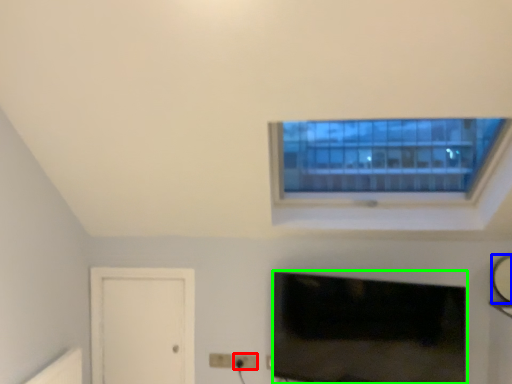
Question: Which object is the closest to the electric outlet (highlighted by a red box)? Choose among these: mirror (highlighted by a blue box) or television (highlighted by a green box).

Choices:
 (A) mirror
 (B) television

Answer: (B)